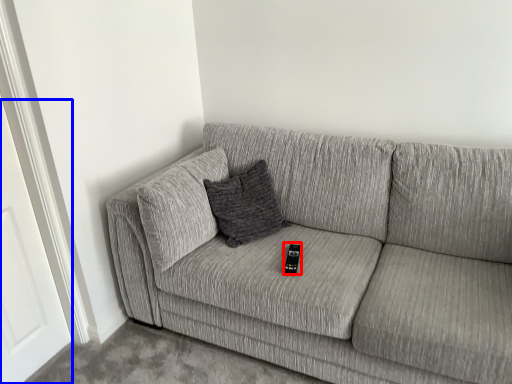
Question: Which object appears closest to the camera in this image, remote (highlighted by a red box) or door (highlighted by a blue box)?

Choices:
 (A) remote
 (B) door

Answer: (B)